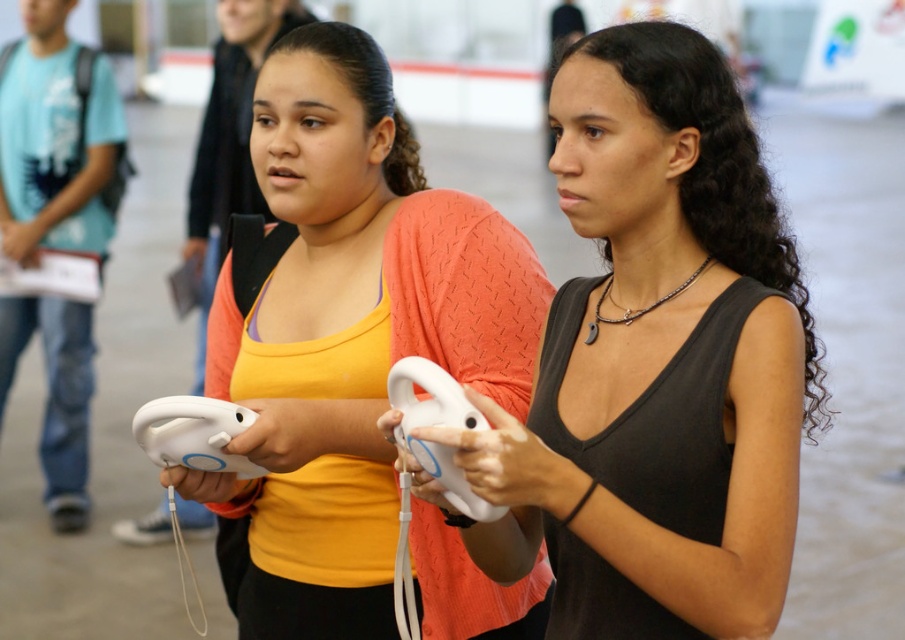
You are standing in a public event and holding a remote control that has a range of 3 meters. You want to interact with the matte white controller at center. Is your remote control able to reach it?

The matte white controller at center is 3.06 meters away from the viewer. Since the remote control has a range of 3 meters, it cannot reach the matte white controller at center as it is slightly beyond the maximum range.

From the picture: You are a photographer at this event and want to capture a closeup of the black matte tank top at center and the white matte wii controller at center. If you want to ensure both objects are in focus, which one should you focus on first?

The black matte tank top at center is larger in size than the white matte wii controller at center, so you should focus on the black matte tank top at center first to ensure both are in focus.